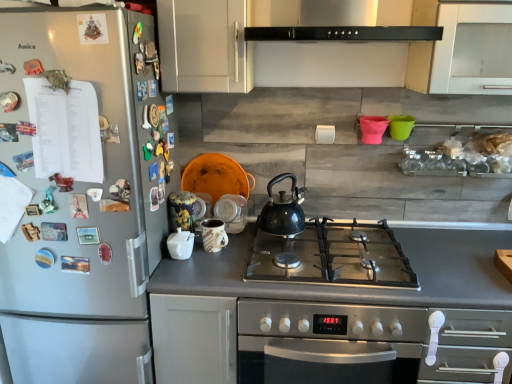
Describe the element at coordinates (232, 212) in the screenshot. This screenshot has height=384, width=512. I see `matte ceramic cups at center, the first appliance when ordered from back to front` at that location.

Measure the distance between white matte cabinet at upper center and camera.

white matte cabinet at upper center is 4.46 feet from camera.

Describe the element at coordinates (80, 194) in the screenshot. I see `satin silver refrigerator at left` at that location.

Locate an element on the screen. Image resolution: width=512 pixels, height=384 pixels. matte ceramic mug at center, which is the 2th appliance from front to back is located at coordinates (213, 235).

Considering the sizes of objects black matte kettle at center and matte ceramic cups at center, the first appliance when ordered from back to front, in the image provided, who is wider, black matte kettle at center or matte ceramic cups at center, the first appliance when ordered from back to front,?

matte ceramic cups at center, the first appliance when ordered from back to front, is wider.

Would you consider black matte kettle at center to be distant from matte ceramic cups at center, the first appliance when ordered from back to front?

No, black matte kettle at center is not far from matte ceramic cups at center, the first appliance when ordered from back to front.

Is black matte kettle at center oriented towards matte ceramic cups at center, the first appliance when ordered from back to front?

No.

Which is behind, black matte kettle at center or matte ceramic cups at center, the 3th appliance positioned from the front?

Positioned behind is matte ceramic cups at center, the 3th appliance positioned from the front.

Is stainless steel oven at center oriented towards black matte kettle at center?

No, stainless steel oven at center is not turned towards black matte kettle at center.

Would you say stainless steel oven at center is a long distance from black matte kettle at center?

They are positioned close to each other.

Based on their sizes in the image, would you say stainless steel oven at center is bigger or smaller than black matte kettle at center?

In the image, stainless steel oven at center appears to be larger than black matte kettle at center.

Does stainless steel oven at center come behind black matte kettle at center?

No, it is in front of black matte kettle at center.

Considering their positions, is matte ceramic mug at center, which is the 2th appliance from front to back, located in front of or behind stainless steel oven at center?

Clearly, matte ceramic mug at center, which is the 2th appliance from front to back, is behind stainless steel oven at center.

Considering the sizes of matte ceramic mug at center, which is counted as the second appliance, starting from the back, and stainless steel oven at center in the image, is matte ceramic mug at center, which is counted as the second appliance, starting from the back, wider or thinner than stainless steel oven at center?

In the image, matte ceramic mug at center, which is counted as the second appliance, starting from the back, appears to be more narrow than stainless steel oven at center.

Does matte ceramic mug at center, which is counted as the second appliance, starting from the back, appear on the right side of stainless steel oven at center?

No.

Is matte ceramic mug at center, which is counted as the second appliance, starting from the back, inside the boundaries of stainless steel oven at center, or outside?

The correct answer is: outside.

Can you confirm if satin silver refrigerator at left is taller than white matte cabinet at upper center?

Correct, satin silver refrigerator at left is much taller as white matte cabinet at upper center.

Is satin silver refrigerator at left not close to white matte cabinet at upper center?

No, satin silver refrigerator at left is not far away from white matte cabinet at upper center.

From a real-world perspective, who is located higher, satin silver refrigerator at left or white matte cabinet at upper center?

white matte cabinet at upper center is physically above.

Identify the location of cabinetry behind the satin silver refrigerator at left. The height and width of the screenshot is (384, 512). (203, 45).

From the image's perspective, is satin silver refrigerator at left located above or below matte ceramic cups at center, the first appliance when ordered from back to front?

satin silver refrigerator at left is situated lower than matte ceramic cups at center, the first appliance when ordered from back to front, in the image.

How different are the orientations of satin silver refrigerator at left and matte ceramic cups at center, the first appliance when ordered from back to front, in degrees?

The facing directions of satin silver refrigerator at left and matte ceramic cups at center, the first appliance when ordered from back to front, are 0.785 degrees apart.

Are satin silver refrigerator at left and matte ceramic cups at center, the 3th appliance positioned from the front, located far from each other?

Actually, satin silver refrigerator at left and matte ceramic cups at center, the 3th appliance positioned from the front, are a little close together.

From the picture: From a real-world perspective, which is physically above, satin silver refrigerator at left or matte ceramic cups at center, the 3th appliance positioned from the front?

matte ceramic cups at center, the 3th appliance positioned from the front.

Which is in front, point (229, 201) or point (175, 251)?

The point (175, 251) is closer.

From the image's perspective, is matte ceramic cups at center, the first appliance when ordered from back to front, on white glossy sugar bowl at center, positioned as the third appliance in back-to-front order?

Yes, from the image's perspective, matte ceramic cups at center, the first appliance when ordered from back to front, is above white glossy sugar bowl at center, positioned as the third appliance in back-to-front order.

Can we say matte ceramic cups at center, the 3th appliance positioned from the front, lies outside white glossy sugar bowl at center, marked as the first appliance in a front-to-back arrangement?

Yes, matte ceramic cups at center, the 3th appliance positioned from the front, is outside of white glossy sugar bowl at center, marked as the first appliance in a front-to-back arrangement.

How distant is matte ceramic cups at center, the first appliance when ordered from back to front, from white glossy sugar bowl at center, positioned as the third appliance in back-to-front order?

The distance of matte ceramic cups at center, the first appliance when ordered from back to front, from white glossy sugar bowl at center, positioned as the third appliance in back-to-front order, is 8.74 inches.

From a real-world perspective, is black matte kettle at center under stainless steel oven at center?

No, from a real-world perspective, black matte kettle at center is not below stainless steel oven at center.

Which object is closer to the camera taking this photo, black matte kettle at center or stainless steel oven at center?

stainless steel oven at center is more forward.

Considering the sizes of objects black matte kettle at center and stainless steel oven at center in the image provided, who is shorter, black matte kettle at center or stainless steel oven at center?

black matte kettle at center.

Which point is more forward, (276, 233) or (272, 349)?

The point (272, 349) is more forward.

I want to click on kettle in front of the matte ceramic cups at center, the 3th appliance positioned from the front, so click(x=282, y=210).

What are the coordinates of `kettle on the left of stainless steel oven at center` in the screenshot? It's located at (282, 210).

Estimate the real-world distances between objects in this image. Which object is further from white matte cabinet at upper center, satin silver refrigerator at left or black matte kettle at center?

black matte kettle at center lies further to white matte cabinet at upper center than the other object.

When comparing their distances from satin silver refrigerator at left, does stainless steel oven at center or matte ceramic mug at center, which is the 2th appliance from front to back, seem closer?

Based on the image, matte ceramic mug at center, which is the 2th appliance from front to back, appears to be nearer to satin silver refrigerator at left.

Considering their positions, is white matte cabinet at upper center positioned further to satin silver refrigerator at left than white glossy sugar bowl at center, marked as the first appliance in a front-to-back arrangement?

white glossy sugar bowl at center, marked as the first appliance in a front-to-back arrangement, lies further to satin silver refrigerator at left than the other object.

From the image, which object appears to be farther from white glossy sugar bowl at center, positioned as the third appliance in back-to-front order, matte ceramic cups at center, the 3th appliance positioned from the front, or matte ceramic mug at center, which is the 2th appliance from front to back?

matte ceramic cups at center, the 3th appliance positioned from the front.

From the image, which object appears to be nearer to white glossy sugar bowl at center, marked as the first appliance in a front-to-back arrangement, stainless steel oven at center or white matte cabinet at upper center?

Based on the image, stainless steel oven at center appears to be nearer to white glossy sugar bowl at center, marked as the first appliance in a front-to-back arrangement.

When comparing their distances from satin silver refrigerator at left, does white glossy sugar bowl at center, marked as the first appliance in a front-to-back arrangement, or black matte kettle at center seem closer?

white glossy sugar bowl at center, marked as the first appliance in a front-to-back arrangement, is positioned closer to the anchor satin silver refrigerator at left.

From the image, which object appears to be farther from white glossy sugar bowl at center, marked as the first appliance in a front-to-back arrangement, white matte cabinet at upper center or matte ceramic mug at center, which is counted as the second appliance, starting from the back?

Among the two, white matte cabinet at upper center is located further to white glossy sugar bowl at center, marked as the first appliance in a front-to-back arrangement.

Estimate the real-world distances between objects in this image. Which object is closer to satin silver refrigerator at left, stainless steel oven at center or white matte cabinet at upper center?

Among the two, white matte cabinet at upper center is located nearer to satin silver refrigerator at left.

You are a GUI agent. You are given a task and a screenshot of the screen. Output one action in this format:
    pyautogui.click(x=<x>, y=<y>)
    Task: Click on the appliance between white matte cabinet at upper center and matte ceramic mug at center, which is the 2th appliance from front to back, in the up-down direction
    The width and height of the screenshot is (512, 384).
    Given the screenshot: What is the action you would take?
    pyautogui.click(x=232, y=212)

The image size is (512, 384). I want to click on kettle between white matte cabinet at upper center and stainless steel oven at center in the up-down direction, so click(x=282, y=210).

This screenshot has height=384, width=512. I want to click on kettle that lies between white matte cabinet at upper center and matte ceramic mug at center, which is the 2th appliance from front to back, from top to bottom, so click(x=282, y=210).

Identify the location of kettle that lies between white matte cabinet at upper center and white glossy sugar bowl at center, positioned as the third appliance in back-to-front order, from top to bottom. (282, 210).